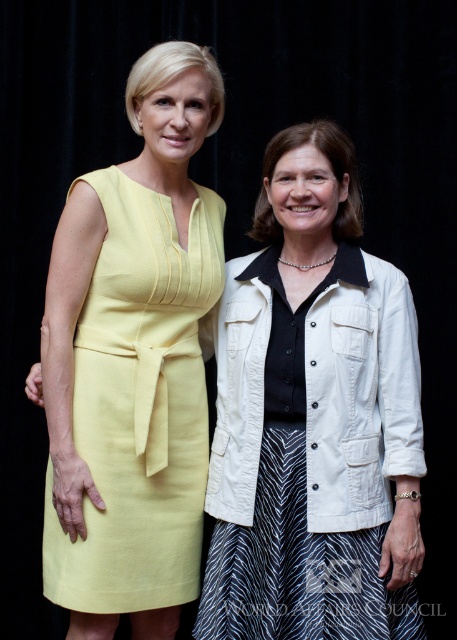
You are a photographer setting up for a photoshoot. You have a camera with a 10 inch focus range. The two subjects are wearing the white textured jacket at center and the linen yellow dress at left. Can you capture both in focus without moving the camera?

The distance between the white textured jacket at center and the linen yellow dress at left is 8.68 inches, which is within the 10 inch focus range. Therefore, you can capture both in focus without moving the camera.

You are a photographer setting up a photo shoot with two women wearing the white textured jacket at center and the linen yellow dress at left. The jacket is much taller than the dress. To ensure both subjects are framed properly, which clothing item should you position closer to the camera to avoid one appearing too small in the frame?

The linen yellow dress at left should be positioned closer to the camera because it is shorter than the white textured jacket at center, so moving it forward will help balance their sizes in the frame.